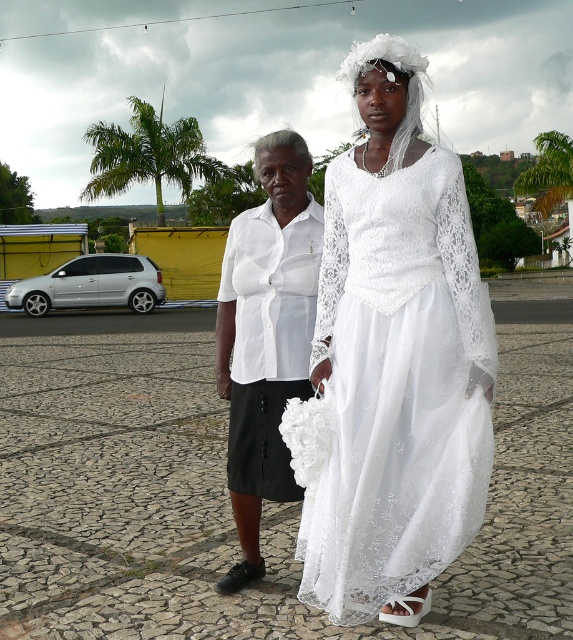
Can you confirm if white lace dress at center is taller than white cotton blouse at center?

Correct, white lace dress at center is much taller as white cotton blouse at center.

Is white lace dress at center smaller than white cotton blouse at center?

Actually, white lace dress at center might be larger than white cotton blouse at center.

Is point (390, 344) less distant than point (272, 396)?

Yes, it is in front of point (272, 396).

Locate an element on the screen. This screenshot has height=640, width=573. white lace dress at center is located at coordinates (393, 362).